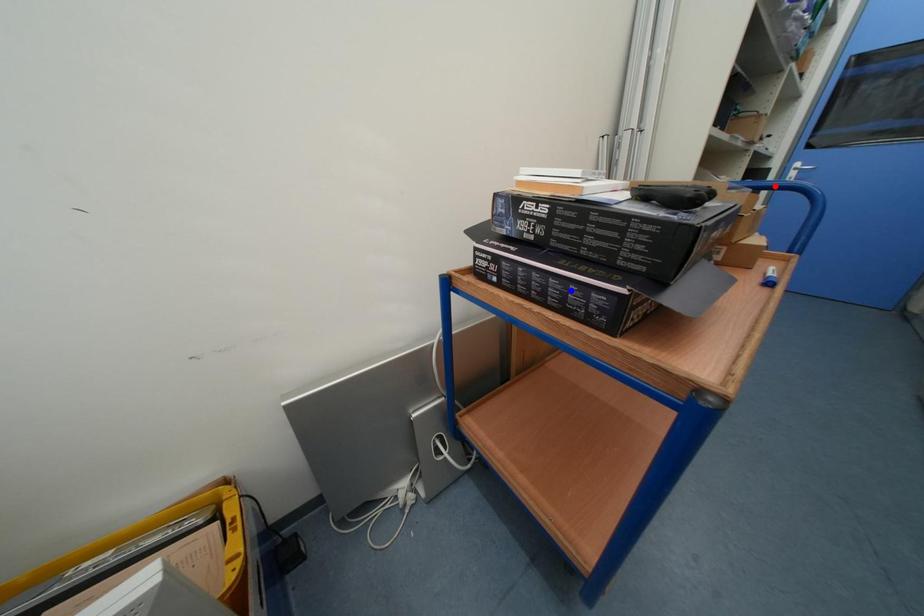
Question: In the image, two points are highlighted. Which point is nearer to the camera? Reply with the corresponding letter.

Choices:
 (A) blue point
 (B) red point

Answer: (A)